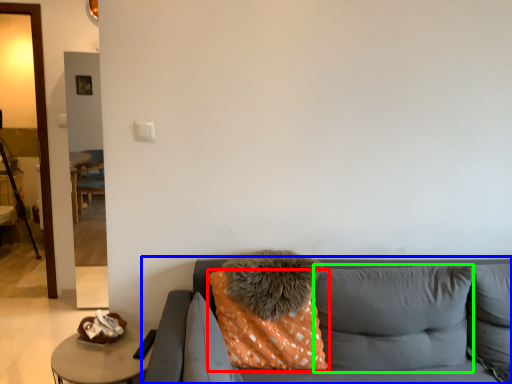
Question: Which object is positioned closest to pillow (highlighted by a red box)? Select from studio couch (highlighted by a blue box) and pillow (highlighted by a green box).

Choices:
 (A) studio couch
 (B) pillow

Answer: (A)